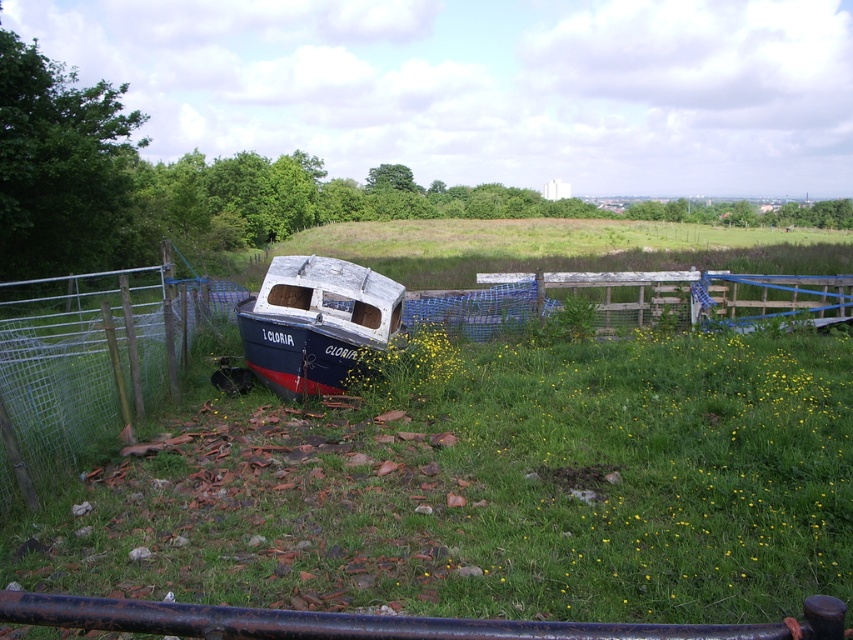
You are a farmer checking the boundaries of your field. You notice the wire mesh fence at lower left and the rusty metal rail at lower center. Which boundary marker is located to the left of the other?

The wire mesh fence at lower left is positioned on the left side of the rusty metal rail at lower center, so the wire mesh fence at lower left is to the left of the rusty metal rail at lower center.

You are a gardener planning to mow the green grassy at center and the rusty metal rail at lower center. Which object should you avoid mowing to prevent damage?

You should avoid mowing the rusty metal rail at lower center because the green grassy at center is shorter than the rusty metal rail at lower center, meaning the rail is taller and could be damaged by the mower.

You are standing at point A and want to reach the abandoned boat named CLORIA located at point B. The coordinates of point A are given as point A is at point (492, 493). What is the terrain like at point A?

The terrain at point A is green grassy at center.